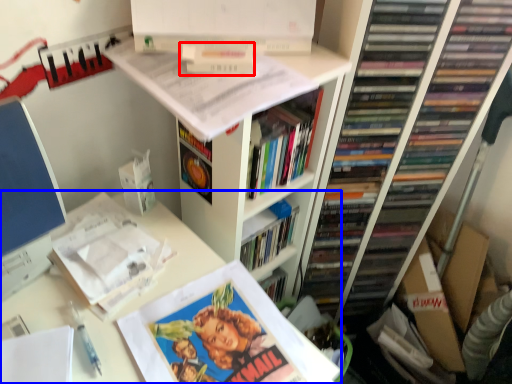
Question: Which object appears closest to the camera in this image, book (highlighted by a red box) or computer desk (highlighted by a blue box)?

Choices:
 (A) book
 (B) computer desk

Answer: (B)